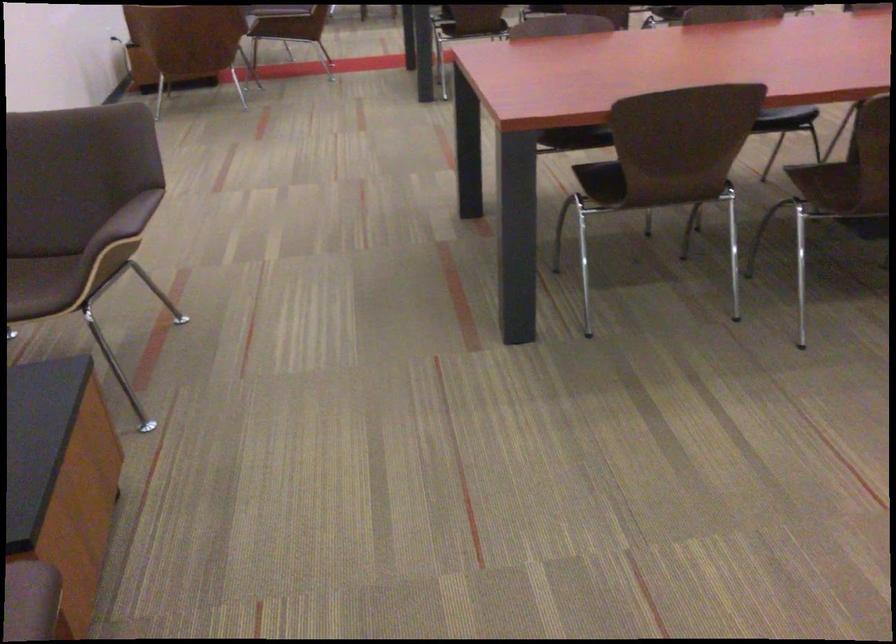
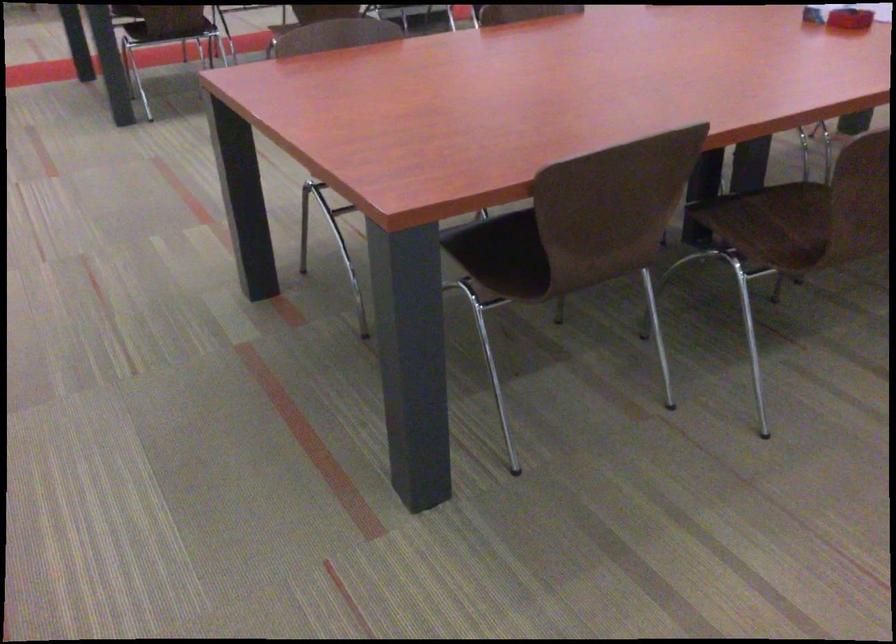
The images are taken continuously from a first-person perspective. In which direction are you moving?

The cameraman moved toward left, forward.